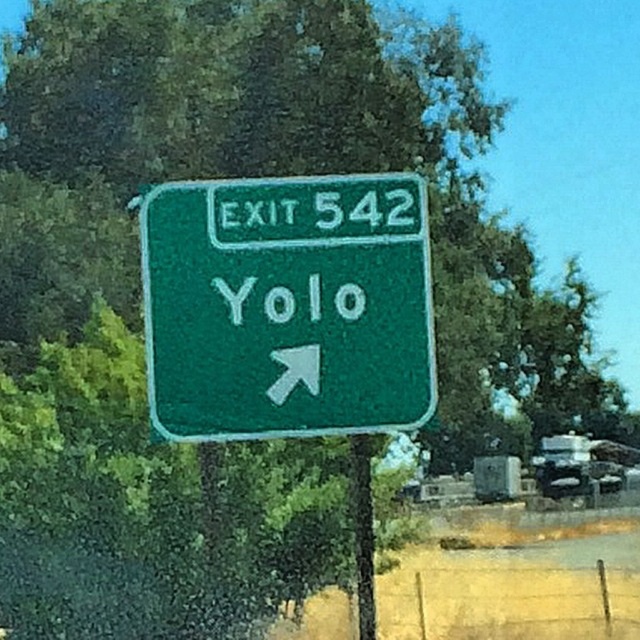
You are driving a car that is 15 feet long. You want to pull over to the side of the road near the green textured sign at center. Is there enough space between your car and the sign to safely park without blocking the exit sign?

The green textured sign at center is 30.73 feet from viewer. Since your car is 15 feet long, there is sufficient space between you and the sign to park safely without obstructing it.

You are a highway worker measuring the height of the green painted metal pole at center and the green textured sign at center. Which object has a greater height?

The green textured sign at center has a greater height compared to the green painted metal pole at center.

You are driving and need to check if the green painted metal pole at center can support the weight of the green textured sign at center. Given that the pole is rated for objects up to its own size, would it be safe?

The green textured sign at center has a larger size compared to green painted metal pole at center. Since the pole is rated for objects up to its own size, the sign exceeds the pole capacity, making it unsafe.